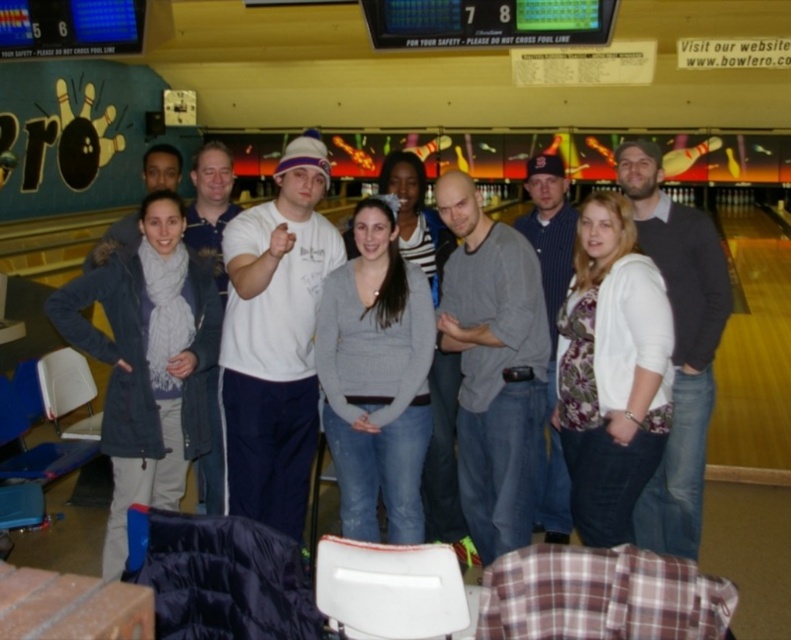
Question: Which point is closer to the camera?

Choices:
 (A) gray cotton shirt at center
 (B) dark blue textured coat at left
 (C) gray sweater at center
 (D) white cotton shirt at center

Answer: (C)

Question: Which of these objects is positioned closest to the blue striped shirt at center?

Choices:
 (A) white cotton t-shirt at center
 (B) dark gray sweater at center
 (C) gray sweater at center
 (D) dark blue textured coat at left

Answer: (B)

Question: Which point is closer to the camera?

Choices:
 (A) floral print sweater at center
 (B) dark gray sweater at center
 (C) dark blue textured coat at left

Answer: (A)

Question: Does gray cotton shirt at center have a lesser width compared to dark gray sweater at center?

Choices:
 (A) yes
 (B) no

Answer: (A)

Question: Can you confirm if gray sweater at center is positioned below dark gray sweater at center?

Choices:
 (A) yes
 (B) no

Answer: (A)

Question: Is gray cotton shirt at center thinner than gray sweater at center?

Choices:
 (A) no
 (B) yes

Answer: (B)